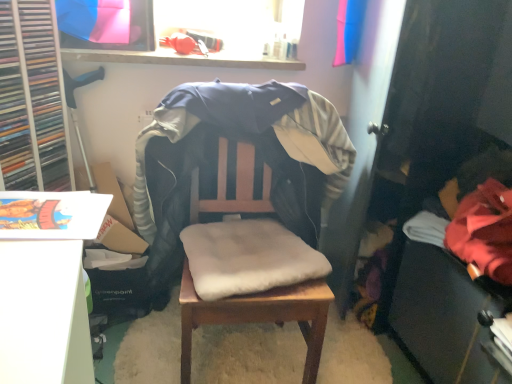
Question: Can you confirm if wooden chair with cushion at center is bigger than red fleece jacket at lower right?

Choices:
 (A) no
 (B) yes

Answer: (B)

Question: Is wooden chair with cushion at center oriented towards red fleece jacket at lower right?

Choices:
 (A) no
 (B) yes

Answer: (A)

Question: From a real-world perspective, is wooden chair with cushion at center physically below red fleece jacket at lower right?

Choices:
 (A) yes
 (B) no

Answer: (A)

Question: Is wooden chair with cushion at center outside red fleece jacket at lower right?

Choices:
 (A) no
 (B) yes

Answer: (B)

Question: Does wooden chair with cushion at center have a smaller size compared to red fleece jacket at lower right?

Choices:
 (A) yes
 (B) no

Answer: (B)

Question: From the image's perspective, is wooden chair with cushion at center beneath red fleece jacket at lower right?

Choices:
 (A) yes
 (B) no

Answer: (A)

Question: Is red fleece jacket at lower right outside wooden table at center?

Choices:
 (A) yes
 (B) no

Answer: (A)

Question: Is red fleece jacket at lower right oriented towards wooden table at center?

Choices:
 (A) yes
 (B) no

Answer: (B)

Question: From a real-world perspective, is red fleece jacket at lower right under wooden table at center?

Choices:
 (A) yes
 (B) no

Answer: (B)

Question: Can you confirm if red fleece jacket at lower right is taller than wooden table at center?

Choices:
 (A) yes
 (B) no

Answer: (A)

Question: Is red fleece jacket at lower right far from wooden table at center?

Choices:
 (A) no
 (B) yes

Answer: (A)

Question: From the image's perspective, is red fleece jacket at lower right over wooden table at center?

Choices:
 (A) yes
 (B) no

Answer: (A)

Question: Is wooden table at center outside of soft beige cushion at center?

Choices:
 (A) no
 (B) yes

Answer: (B)